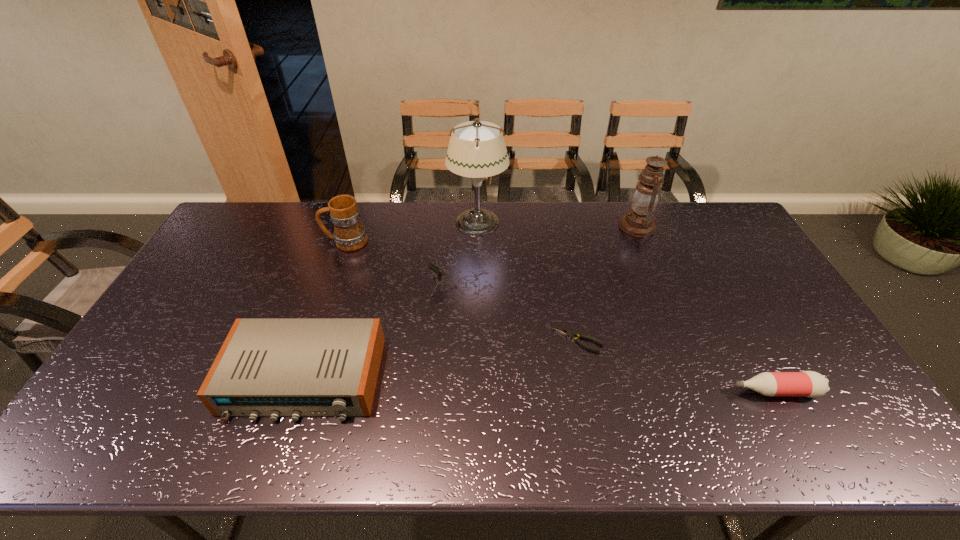
The width and height of the screenshot is (960, 540). Find the location of `vacant space that satisfies the following two spatial constraints: 1. on the stand of the microphone; 2. on the front panel of the radio receiver`. vacant space that satisfies the following two spatial constraints: 1. on the stand of the microphone; 2. on the front panel of the radio receiver is located at coordinates (449, 379).

This screenshot has height=540, width=960. I want to click on vacant region that satisfies the following two spatial constraints: 1. on the back side of the shortest object; 2. on the lampshade of the lampshade, so click(x=554, y=223).

This screenshot has height=540, width=960. Identify the location of vacant space that satisfies the following two spatial constraints: 1. on the stand of the fourth farthest object; 2. on the front panel of the radio receiver. (449, 379).

The height and width of the screenshot is (540, 960). I want to click on free space that satisfies the following two spatial constraints: 1. on the stand of the fourth nearest object; 2. on the right side of the shortest object, so click(x=451, y=340).